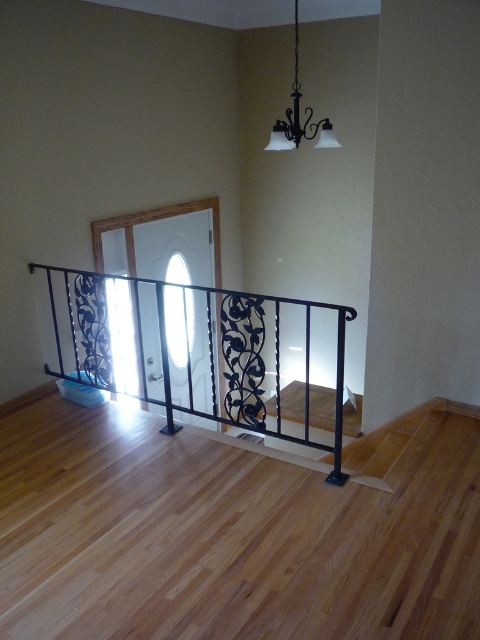
You are standing in the hallway and want to know if the black wrought iron railing at center is positioned under the black matte chandelier at upper center. Can you confirm this?

Yes, the black wrought iron railing at center is located below the black matte chandelier at upper center, so it is positioned under it.

You are a painter who needs to decide which object to paint first. Based on their sizes, which object should you tackle first between the black wrought iron railing at center and the black matte chandelier at upper center?

The black wrought iron railing at center is larger in size than the black matte chandelier at upper center, so you should paint the black wrought iron railing at center first.

From the picture: You are standing in the hallway and want to reach the white door at the end. There is a black wrought iron railing at center marked by point (189, 349). Can you walk straight towards the door without going around the railing?

The black wrought iron railing at center is represented by point (189, 349), which indicates it is positioned directly in your path. Therefore, you cannot walk straight towards the door without encountering the railing and would need to go around it.